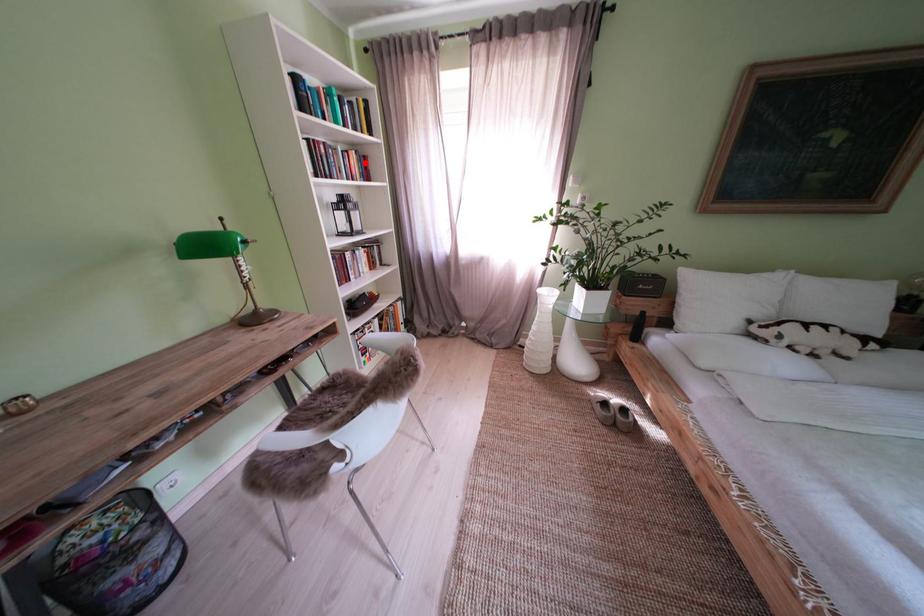
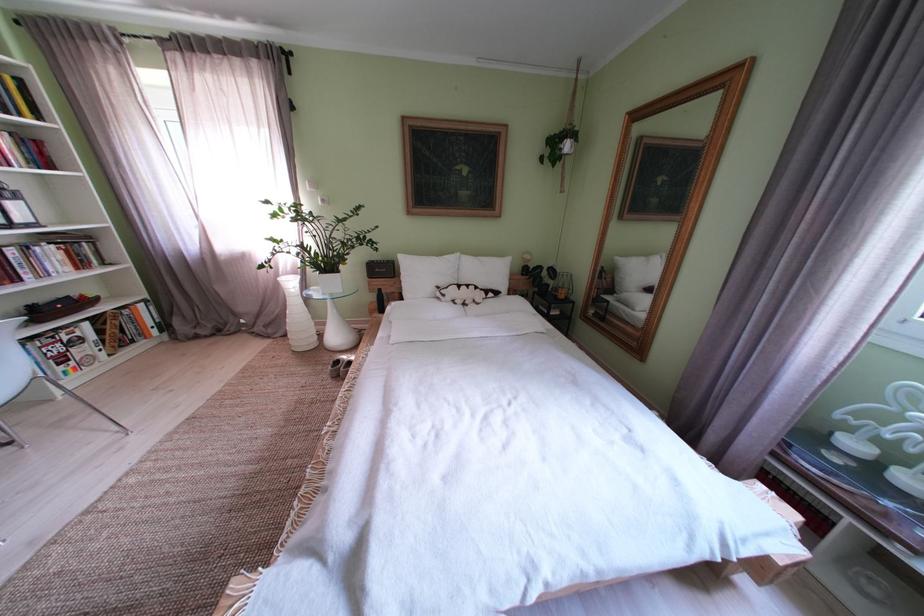
In the second image, find the point that corresponds to the highlighted location in the first image.

(16, 145)